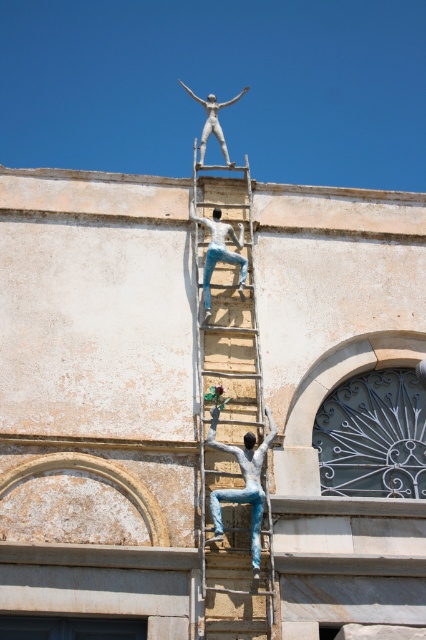
Question: Which is farther from the wooden ladder at upper center?

Choices:
 (A) silver metallic statue at upper center
 (B) denim jeans at center
 (C) white glossy statue at center

Answer: (A)

Question: Can you confirm if white glossy statue at center is wider than silver metallic statue at upper center?

Choices:
 (A) no
 (B) yes

Answer: (A)

Question: Which object is positioned farthest from the wooden ladder at upper center?

Choices:
 (A) denim jeans at center
 (B) silver metallic statue at upper center
 (C) white glossy statue at center

Answer: (B)

Question: Does wooden ladder at upper center appear over denim jeans at center?

Choices:
 (A) no
 (B) yes

Answer: (B)

Question: Among these points, which one is nearest to the camera?

Choices:
 (A) (227, 163)
 (B) (259, 522)
 (C) (241, 472)
 (D) (221, 212)

Answer: (B)

Question: Is white glossy statue at center above silver metallic statue at upper center?

Choices:
 (A) no
 (B) yes

Answer: (A)